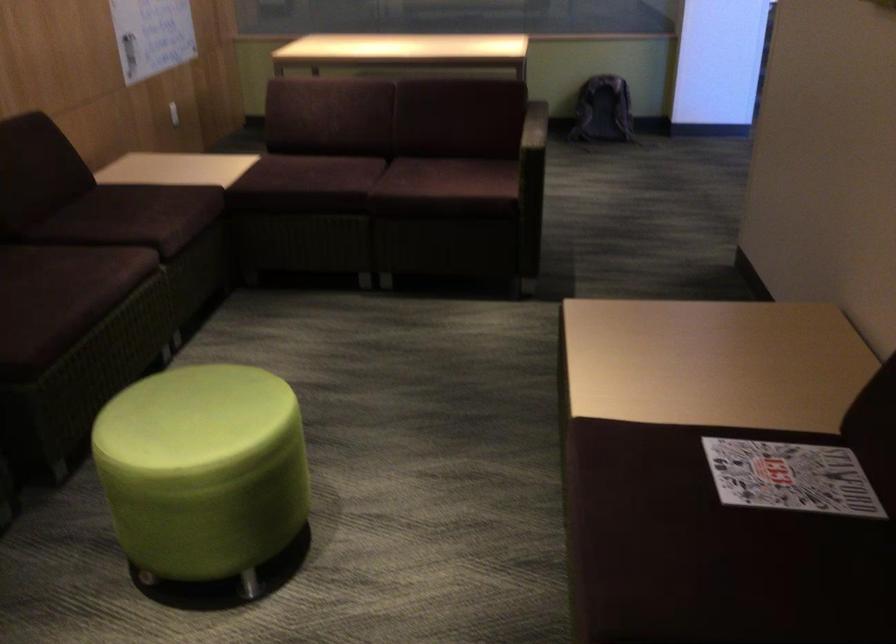
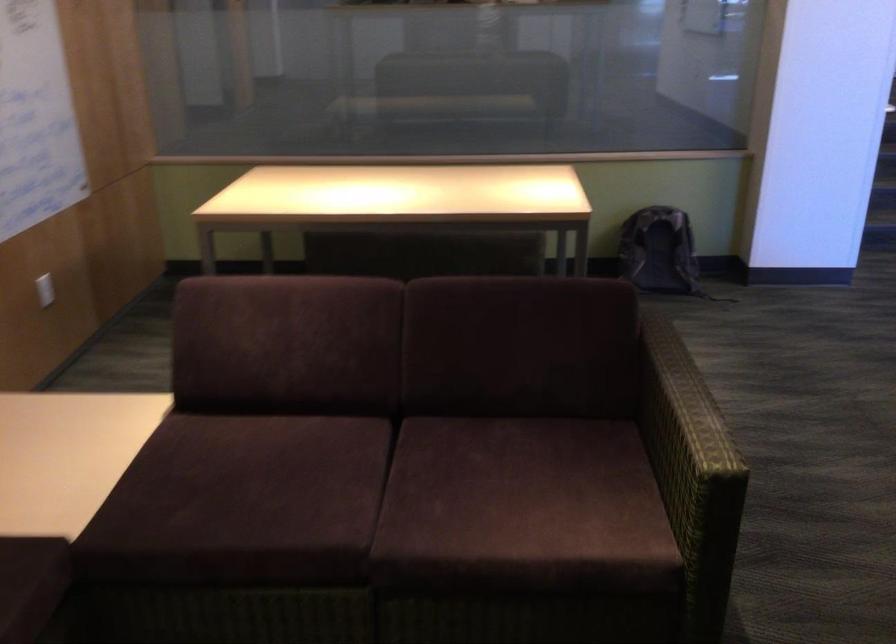
Question: Which direction would the cameraman need to move to produce the second image? Reply with the corresponding letter.

Choices:
 (A) Left
 (B) Right
 (C) Forward
 (D) Backward

Answer: (C)